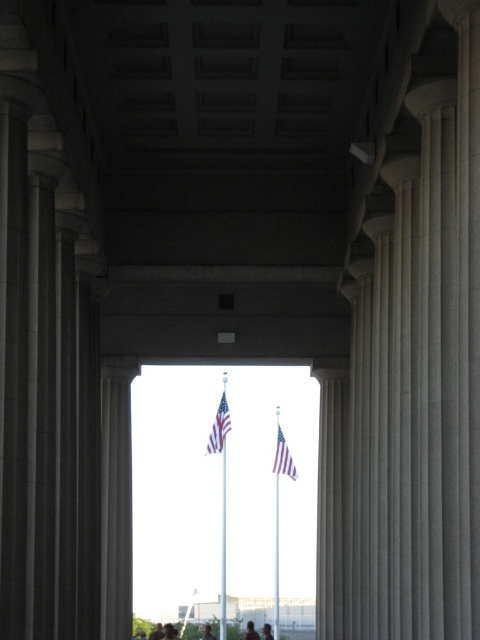
Measure the distance from dark brown hair at center to light brown hair at center.

5.00 meters

Measure the distance between point (207,637) and camera.

Point (207,637) and camera are 251.07 feet apart from each other.

Is point (203, 634) farther from viewer compared to point (266, 637)?

Yes, it is.

Locate an element on the screen. This screenshot has height=640, width=480. dark brown hair at center is located at coordinates (207, 632).

Is point (284, 474) behind point (204, 636)?

That is False.

Is white fabric flag at center shorter than dark brown hair at center?

Indeed, white fabric flag at center has a lesser height compared to dark brown hair at center.

Who is more forward, (283,468) or (205,634)?

Point (283,468) is in front.

Where is `white fabric flag at center`? The width and height of the screenshot is (480, 640). white fabric flag at center is located at coordinates (283, 458).

Does point (162, 637) come farther from viewer compared to point (269, 628)?

That is True.

Does dark hair at center have a greater width compared to light brown hair at center?

Yes.

Does point (152, 632) come closer to viewer compared to point (265, 628)?

No, (152, 632) is further to viewer.

The image size is (480, 640). Identify the location of dark hair at center. (156, 632).